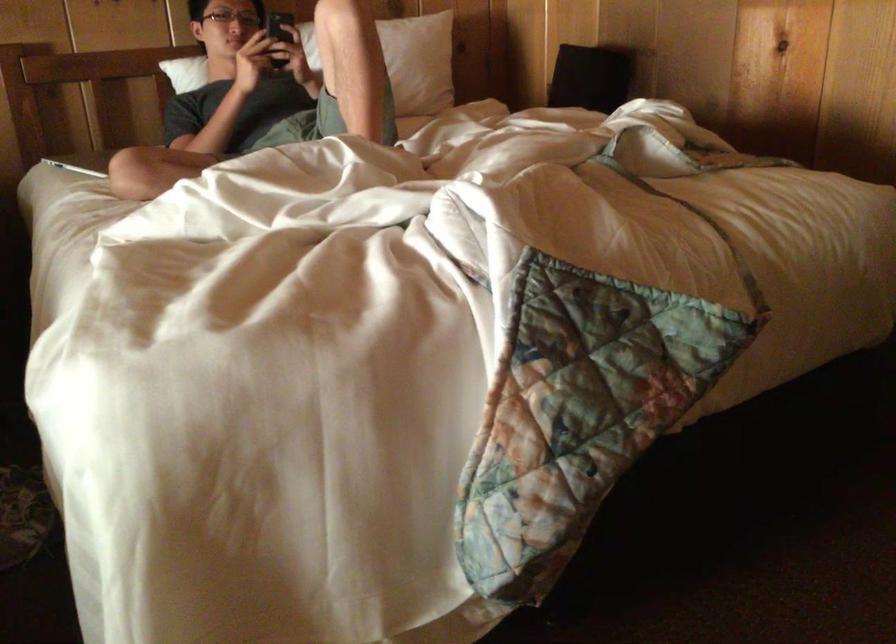
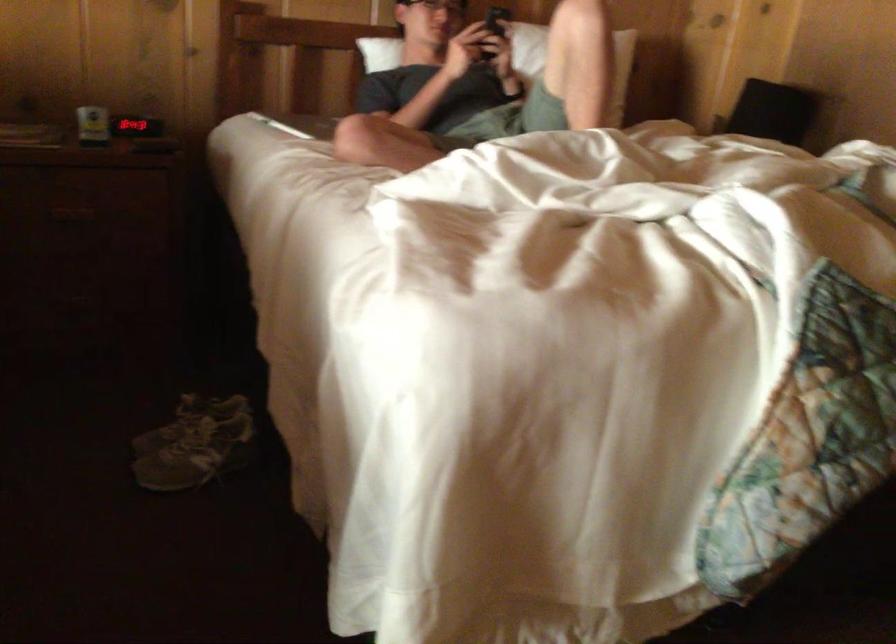
The point at [342,67] is marked in the first image. Where is the corresponding point in the second image?

(573, 61)